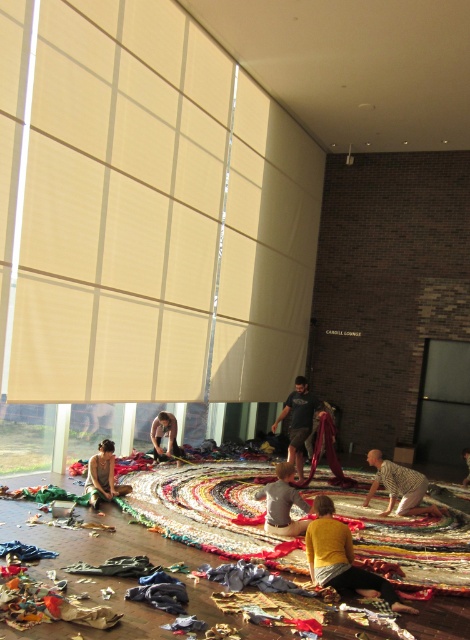
You are an interior designer who needs to place a new sofa in the living room. The sofa is 23 inches wide. Can the sofa fit between the multicolored fabric rug at lower left and the matte black fabric at lower left?

The multicolored fabric rug at lower left is 22.95 inches away from the matte black fabric at lower left, so the sofa cannot fit between them since the distance is slightly less than the sofa width.

You are standing in the room and want to reach the multicolored fabric rug at lower left. If your walking speed is 3 feet per second, how many seconds will it take you to reach it?

The distance between you and the multicolored fabric rug at lower left is 15.72 feet. At a walking speed of 3 feet per second, it will take you 15.72 divided by 3, which is approximately 5.24 seconds to reach it.

You are a visitor standing in the center of the room. You want to pick up the multicolored fabric rug at lower left and the striped fabric at center. How far apart are these two fabrics?

The multicolored fabric rug at lower left and striped fabric at center are 9.10 feet apart from each other.